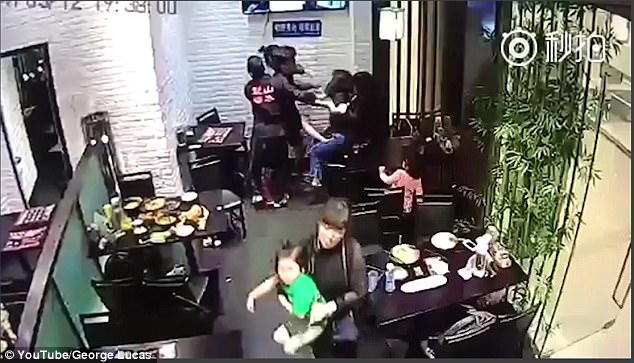
What are the coordinates of `tv` in the screenshot? It's located at pyautogui.click(x=293, y=2).